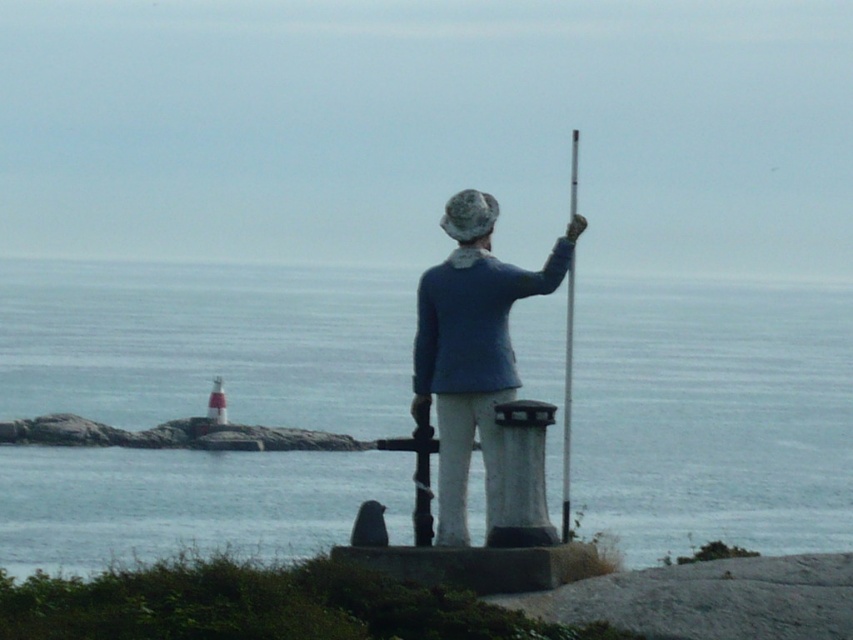
You are a photographer planning to capture the statue and its surroundings. Given that the blue water at center and the blue fabric jacket at center are both in the frame, which one would you focus on to ensure the subject fills the frame adequately?

The blue water at center has a larger size compared to the blue fabric jacket at center, so focusing on the blue water at center would ensure the subject fills the frame adequately.

You are a painter standing 2 meters away from the statue. You want to sketch the blue fabric jacket at center and the metallic pole at center. Can you clearly see both objects in your viewfinder if your camera has a minimum focus distance of 1.5 meters?

The distance between the blue fabric jacket at center and the metallic pole at center is 1.46 meters. Since your camera has a minimum focus distance of 1.5 meters, you are just beyond that threshold at 2 meters away. Therefore, you can clearly see both objects in your viewfinder.

You are a photographer trying to capture the statue and its surroundings. You notice the blue water at center and the blue fabric jacket at center. Which object is located to the left of the other?

The blue water at center is positioned on the left side of blue fabric jacket at center, so the blue water at center is to the left of the blue fabric jacket at center.